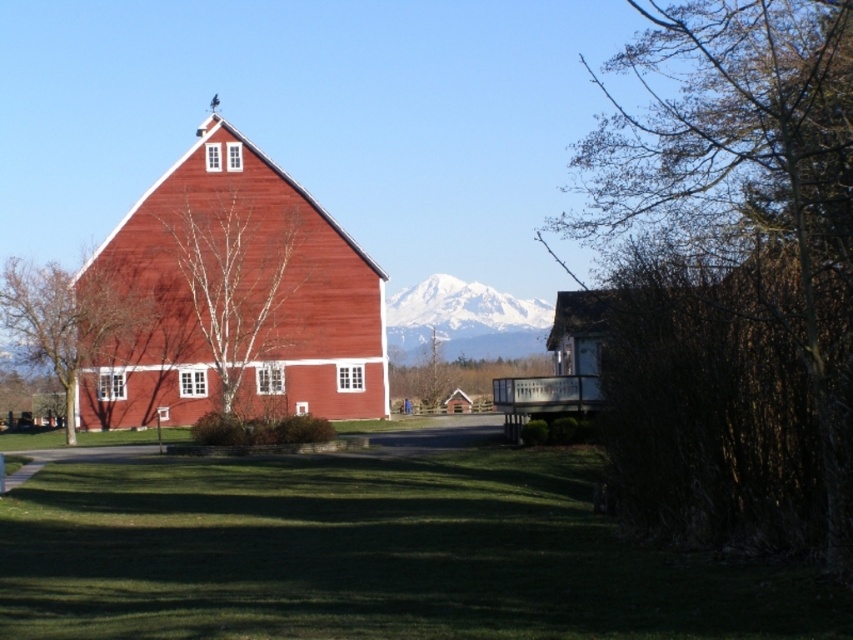
From the picture: Can you confirm if bare birch tree at center is positioned above snowy peak at center?

No, bare birch tree at center is not above snowy peak at center.

Is point (216, 262) less distant than point (486, 316)?

Yes, point (216, 262) is in front of point (486, 316).

Find the location of a particular element. Image resolution: width=853 pixels, height=640 pixels. bare birch tree at center is located at coordinates (235, 280).

Is bare branches at upper right positioned behind bare birch tree at center?

That is False.

Can you confirm if bare branches at upper right is positioned to the left of bare birch tree at center?

No, bare branches at upper right is not to the left of bare birch tree at center.

Locate an element on the screen. bare branches at upper right is located at coordinates (746, 192).

Locate an element on the screen. bare branches at upper right is located at coordinates (746, 192).

Does matte wood barn at center appear over snowy peak at center?

Yes, matte wood barn at center is above snowy peak at center.

Is matte wood barn at center smaller than snowy peak at center?

Incorrect, matte wood barn at center is not smaller in size than snowy peak at center.

Who is more forward, (177, 381) or (398, 324)?

Point (177, 381)

The width and height of the screenshot is (853, 640). Identify the location of matte wood barn at center. (236, 298).